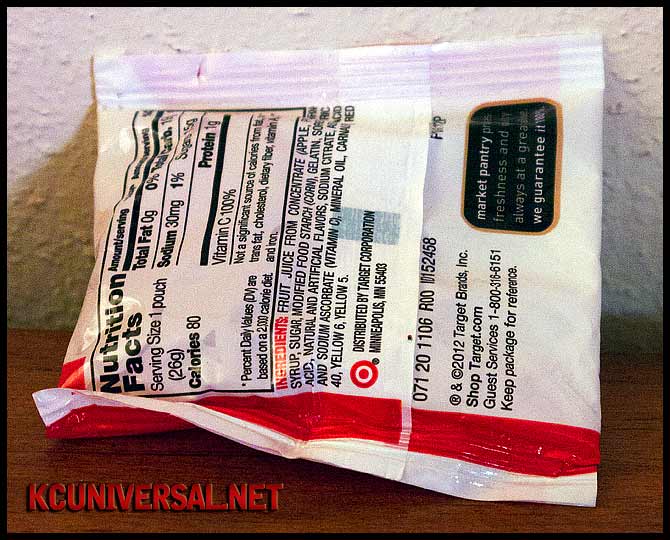
This screenshot has width=670, height=540. In order to click on table in this screenshot , I will do `click(350, 507)`.